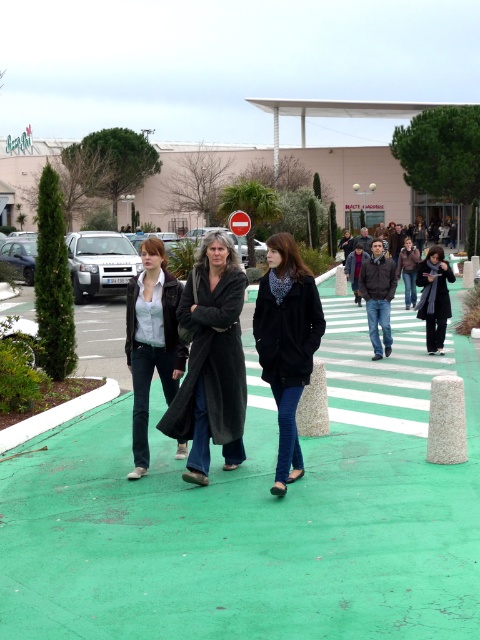
Question: Can you confirm if dark gray wool coat at center is bigger than dark gray coat at center?

Choices:
 (A) no
 (B) yes

Answer: (A)

Question: Can you confirm if black matte coat at center is smaller than matte black jacket at center?

Choices:
 (A) no
 (B) yes

Answer: (A)

Question: Which of the following is the farthest from the observer?

Choices:
 (A) green rubber pavement at center
 (B) dark gray wool coat at center
 (C) black matte coat at center

Answer: (A)

Question: Can you confirm if dark gray wool coat at center is smaller than dark brown leather jacket at center?

Choices:
 (A) no
 (B) yes

Answer: (B)

Question: Which object is closer to the camera taking this photo?

Choices:
 (A) matte black jacket at center
 (B) dark gray coat at center
 (C) dark brown leather jacket at center

Answer: (A)

Question: Which is nearer to the green rubber pavement at center?

Choices:
 (A) matte black jacket at center
 (B) dark brown leather jacket at center
 (C) black matte coat at center
 (D) dark gray wool coat at center

Answer: (A)